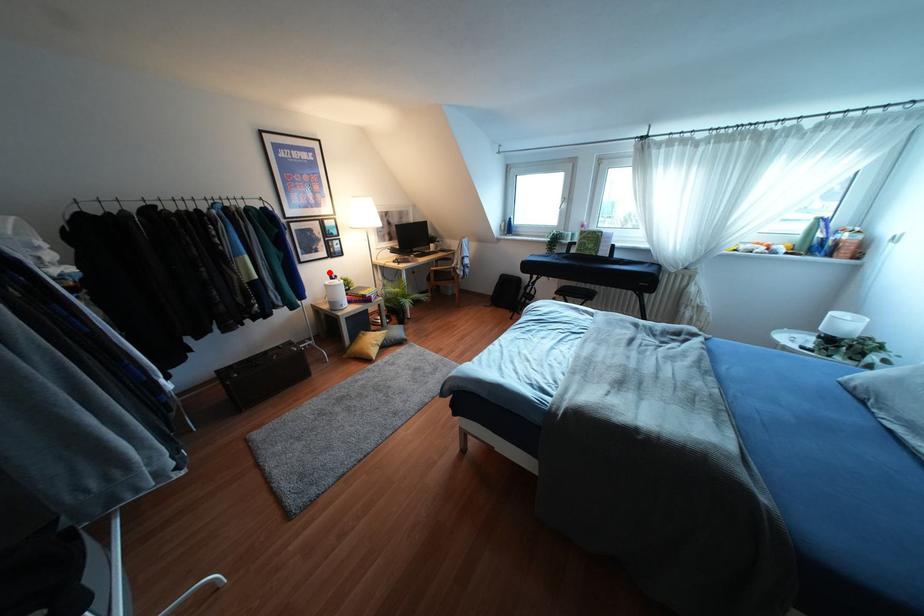
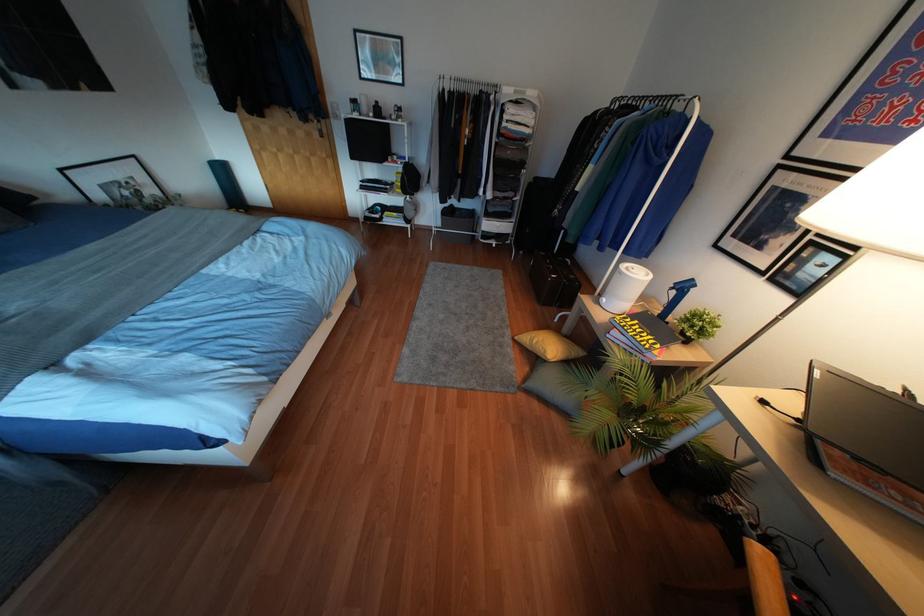
Question: I am providing you with two images of the same scene from different viewpoints. In image1, a red point is highlighted. Considering the same 3D point in image2, which of the following is correct?

Choices:
 (A) It is closer
 (B) It is farther

Answer: (B)